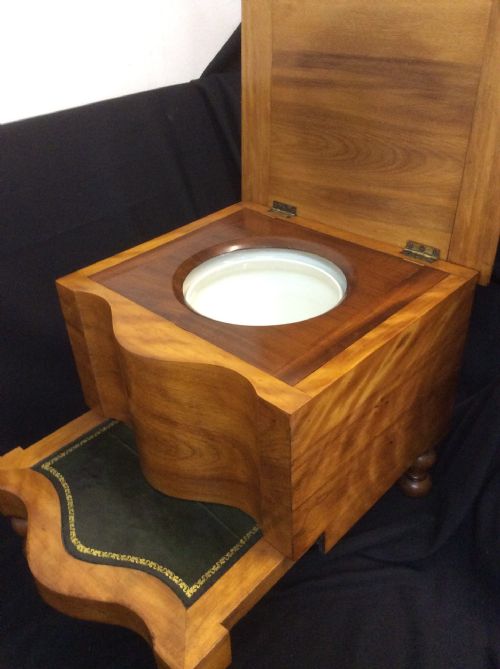
You are a GUI agent. You are given a task and a screenshot of the screen. Output one action in this format:
    pyautogui.click(x=<x>, y=<y>)
    Task: Click on the black sheet
    The height and width of the screenshot is (669, 500).
    Given the screenshot: What is the action you would take?
    pyautogui.click(x=228, y=169)